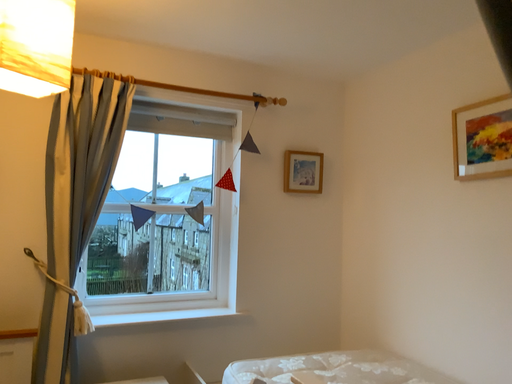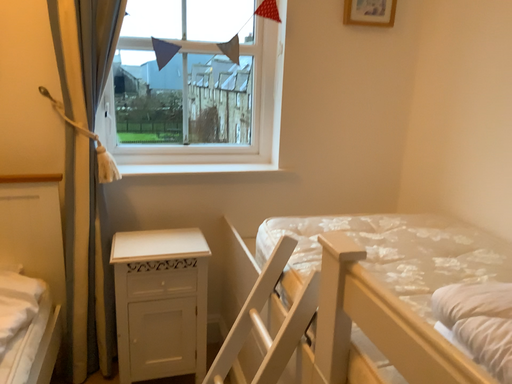
Question: Which way did the camera rotate in the video?

Choices:
 (A) rotated right
 (B) rotated left

Answer: (B)